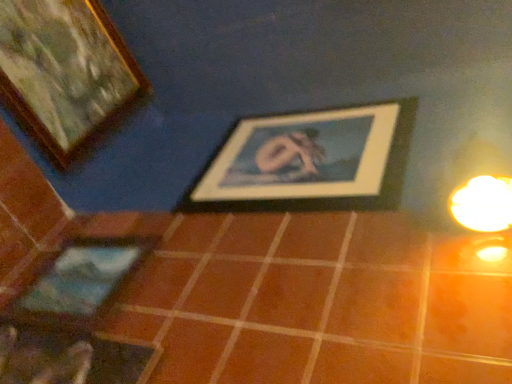
Question: Based on their sizes in the image, would you say brown matte tile at center is bigger or smaller than wooden picture frame at upper left, which is the first picture frame from top to bottom?

Choices:
 (A) small
 (B) big

Answer: (B)

Question: Is brown matte tile at center taller or shorter than wooden picture frame at upper left, which ranks as the first picture frame in left-to-right order?

Choices:
 (A) short
 (B) tall

Answer: (A)

Question: Estimate the real-world distances between objects in this image. Which object is farther from the wooden picture frame at upper left, the 3th picture frame in the bottom-to-top sequence?

Choices:
 (A) matte blue picture frame at lower left, positioned as the 2th picture frame in left-to-right order
 (B) wooden framed picture at center, the 2th picture frame positioned from the top
 (C) brown matte tile at center

Answer: (C)

Question: Which object is positioned closest to the matte blue picture frame at lower left, which appears as the 1th picture frame when ordered from the bottom?

Choices:
 (A) wooden picture frame at upper left, the 3th picture frame in the bottom-to-top sequence
 (B) wooden framed picture at center, which is the third picture frame from left to right
 (C) brown matte tile at center

Answer: (C)